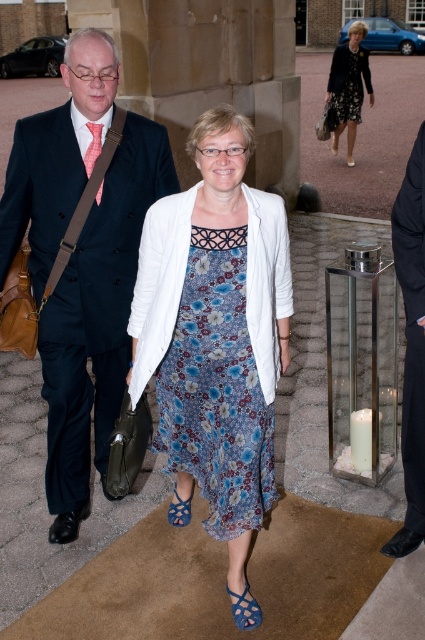
Is black fabric business suit at right positioned behind pink woven tie at center?

No, it is not.

Which is more to the left, black fabric business suit at right or pink woven tie at center?

Positioned to the left is pink woven tie at center.

I want to click on black fabric business suit at right, so click(413, 326).

Does matte black suit at left have a lesser height compared to black textured dress at upper center?

No.

Who is more distant from viewer, (50, 474) or (337, 58)?

The point (337, 58) is more distant.

Does point (85, 282) lie in front of point (328, 97)?

Yes, it is in front of point (328, 97).

In order to click on matte black suit at left in this screenshot , I will do `click(96, 321)`.

Between blue fabric sandal at lower center and pink woven tie at center, which one appears on the left side from the viewer's perspective?

From the viewer's perspective, pink woven tie at center appears more on the left side.

Identify the location of blue fabric sandal at lower center. (244, 609).

Does point (238, 612) come closer to viewer compared to point (96, 138)?

Yes.

The height and width of the screenshot is (640, 425). Find the location of `blue fabric sandal at lower center`. blue fabric sandal at lower center is located at coordinates (244, 609).